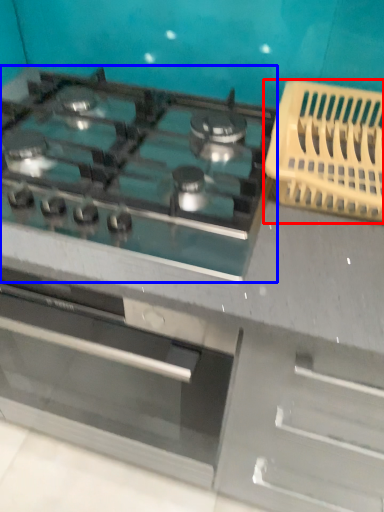
Question: Among these objects, which one is nearest to the camera, basket (highlighted by a red box) or gas stove (highlighted by a blue box)?

Choices:
 (A) basket
 (B) gas stove

Answer: (B)